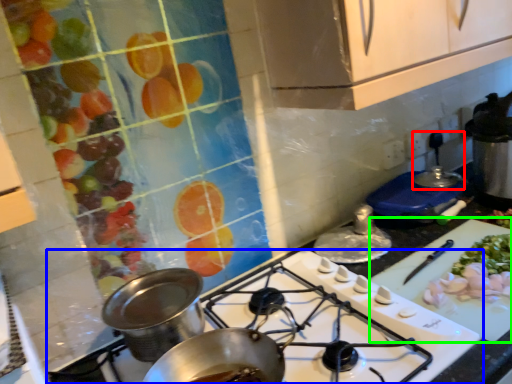
Question: Based on their relative distances, which object is farther from kitchen appliance (highlighted by a red box)? Choose from gas stove (highlighted by a blue box) and cutting board (highlighted by a green box).

Choices:
 (A) gas stove
 (B) cutting board

Answer: (A)